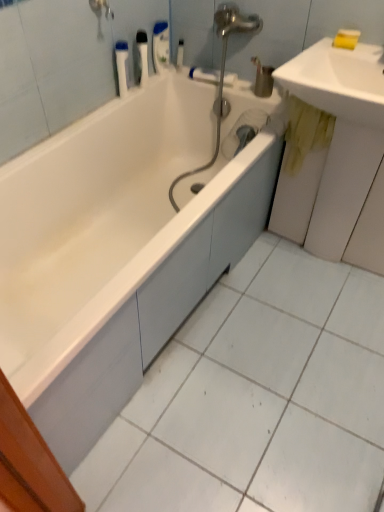
I want to click on vacant space in front of white plastic bottle at upper center, which is counted as the 1th toiletry, starting from the right, so (x=185, y=82).